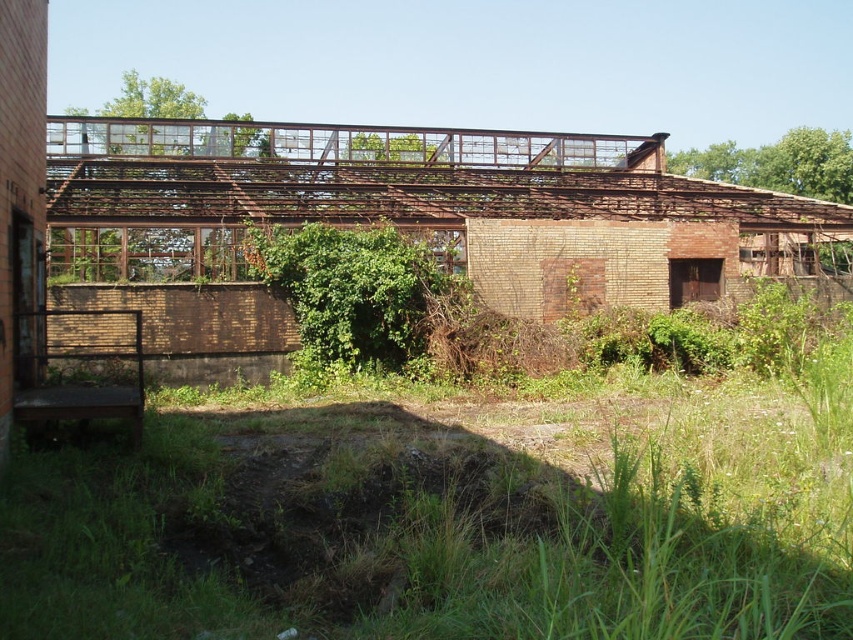
Is green grass at lower center to the left of green leafy bush at center from the viewer's perspective?

No, green grass at lower center is not to the left of green leafy bush at center.

Is green grass at lower center to the right of green leafy bush at center from the viewer's perspective?

Correct, you'll find green grass at lower center to the right of green leafy bush at center.

Who is more forward, (294, 481) or (292, 292)?

Point (294, 481) is in front.

You are a GUI agent. You are given a task and a screenshot of the screen. Output one action in this format:
    pyautogui.click(x=<x>, y=<y>)
    Task: Click on the green grass at lower center
    The width and height of the screenshot is (853, 640).
    Given the screenshot: What is the action you would take?
    pyautogui.click(x=445, y=516)